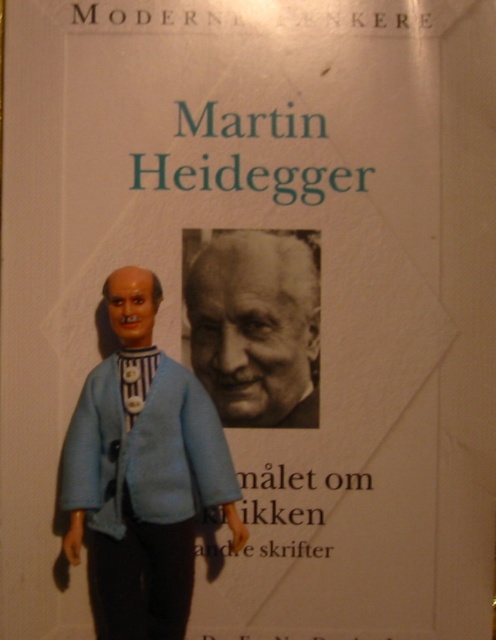
Question: Is matte blue fabric doll at center wider than black and white photograph of martin heidegger at center?

Choices:
 (A) yes
 (B) no

Answer: (A)

Question: From the image, what is the correct spatial relationship of matte blue fabric doll at center in relation to black and white photograph of martin heidegger at center?

Choices:
 (A) above
 (B) below

Answer: (B)

Question: Among these objects, which one is farthest from the camera?

Choices:
 (A) matte blue fabric doll at center
 (B) black and white photograph of martin heidegger at center

Answer: (B)

Question: Does matte blue fabric doll at center lie in front of black and white photograph of martin heidegger at center?

Choices:
 (A) yes
 (B) no

Answer: (A)

Question: Which object is closer to the camera taking this photo?

Choices:
 (A) matte blue fabric doll at center
 (B) black and white photograph of martin heidegger at center

Answer: (A)

Question: Which of the following is the farthest from the observer?

Choices:
 (A) black and white photograph of martin heidegger at center
 (B) matte blue fabric doll at center

Answer: (A)